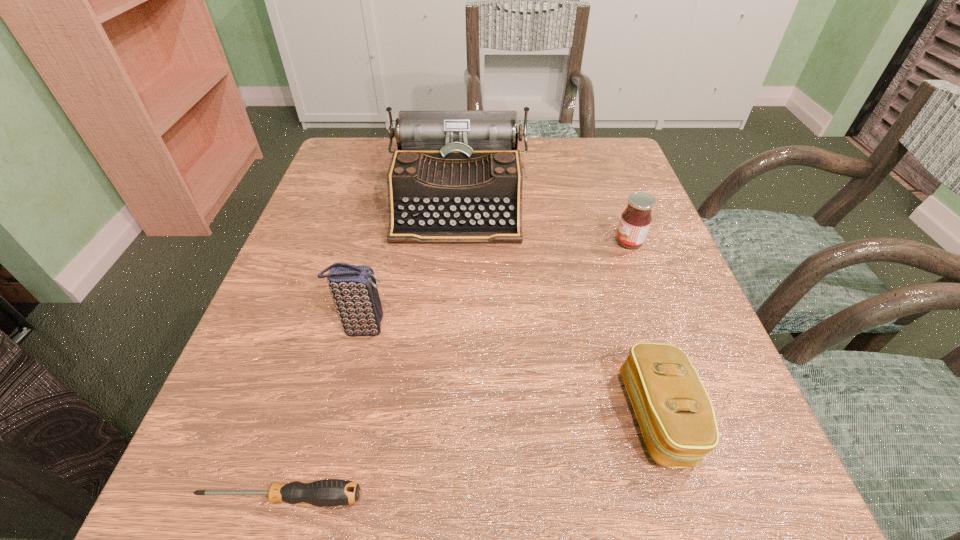
Find the location of `free spot between the shorter clutch bag and the nearest object`. free spot between the shorter clutch bag and the nearest object is located at coordinates (469, 457).

The width and height of the screenshot is (960, 540). Find the location of `vacant area that lies between the third nearest object and the right clutch bag`. vacant area that lies between the third nearest object and the right clutch bag is located at coordinates (511, 372).

Find the location of `free area in between the fourth farthest object and the farther clutch bag`. free area in between the fourth farthest object and the farther clutch bag is located at coordinates (511, 372).

Find the location of `blank region between the third shortest object and the tallest object`. blank region between the third shortest object and the tallest object is located at coordinates (543, 222).

Identify the location of vacant space in between the third shortest object and the fourth farthest object. (644, 329).

You are a GUI agent. You are given a task and a screenshot of the screen. Output one action in this format:
    pyautogui.click(x=<x>, y=<y>)
    Task: Click on the free space between the shortest object and the taller clutch bag
    Image resolution: width=960 pixels, height=540 pixels.
    Given the screenshot: What is the action you would take?
    pyautogui.click(x=322, y=413)

Image resolution: width=960 pixels, height=540 pixels. I want to click on free space between the screwdriver and the shorter clutch bag, so click(469, 457).

Locate an element on the screen. empty space that is in between the third shortest object and the right clutch bag is located at coordinates (644, 329).

This screenshot has width=960, height=540. I want to click on free area in between the third shortest object and the taller clutch bag, so click(x=495, y=285).

Identify the location of vacant point located between the second shortest object and the nearest object. The width and height of the screenshot is (960, 540). (469, 457).